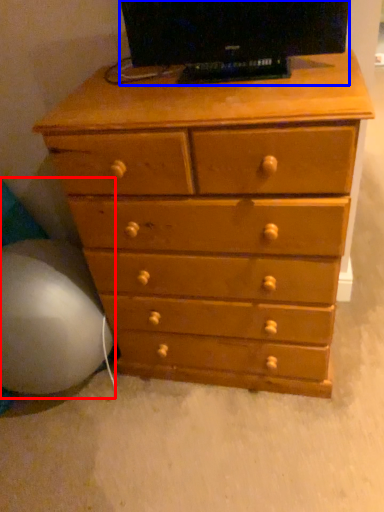
Question: Which object appears closest to the camera in this image, bean bag chair (highlighted by a red box) or television (highlighted by a blue box)?

Choices:
 (A) bean bag chair
 (B) television

Answer: (B)